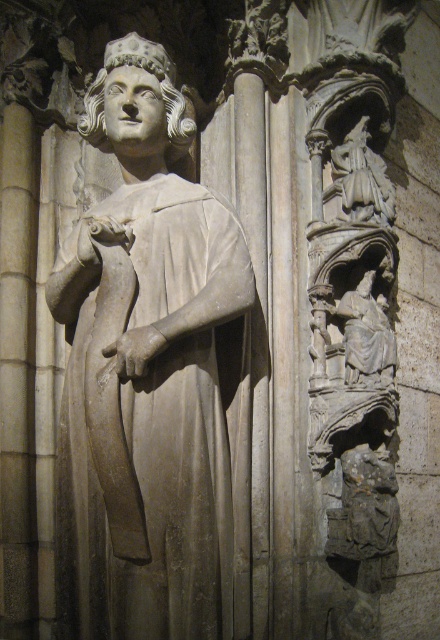
Does gray stone statue at center appear on the right side of gray stone statue at right?

Incorrect, gray stone statue at center is not on the right side of gray stone statue at right.

Does point (114, 276) come behind point (366, 372)?

That is False.

Locate an element on the screen. This screenshot has height=640, width=440. gray stone statue at center is located at coordinates (153, 380).

Image resolution: width=440 pixels, height=640 pixels. In order to click on gray stone statue at right in this screenshot , I will do `click(366, 333)`.

Which is above, gray stone statue at right or gray stone angel at upper right?

Positioned higher is gray stone angel at upper right.

Who is more forward, (392, 355) or (344, 192)?

Point (392, 355) is more forward.

Identify the location of gray stone statue at right. (366, 333).

Is gray stone statue at center above gray stone angel at upper right?

No, gray stone statue at center is not above gray stone angel at upper right.

Is gray stone statue at center positioned before gray stone angel at upper right?

Yes, it is in front of gray stone angel at upper right.

Does point (106, 92) lie in front of point (362, 211)?

Yes, it is.

Where is `gray stone statue at center`? The height and width of the screenshot is (640, 440). gray stone statue at center is located at coordinates (153, 380).